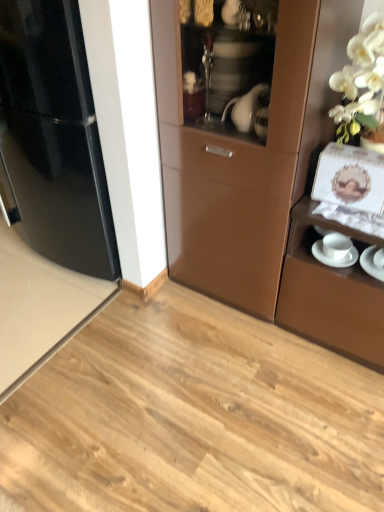
Question: Does white glossy saucer at lower right, marked as the second saucer in a left-to-right arrangement, appear on the left side of glossy black refrigerator at left?

Choices:
 (A) yes
 (B) no

Answer: (B)

Question: From a real-world perspective, is white glossy saucer at lower right, the first saucer in the right-to-left sequence, on glossy black refrigerator at left?

Choices:
 (A) no
 (B) yes

Answer: (A)

Question: From the image's perspective, is white glossy saucer at lower right, the first saucer in the right-to-left sequence, located above glossy black refrigerator at left?

Choices:
 (A) yes
 (B) no

Answer: (B)

Question: From the image's perspective, would you say white glossy saucer at lower right, the first saucer in the right-to-left sequence, is shown under glossy black refrigerator at left?

Choices:
 (A) no
 (B) yes

Answer: (B)

Question: Are white glossy saucer at lower right, marked as the second saucer in a left-to-right arrangement, and glossy black refrigerator at left located far from each other?

Choices:
 (A) no
 (B) yes

Answer: (B)

Question: Is glossy black refrigerator at left at the back of white glossy saucer at lower right, marked as the second saucer in a left-to-right arrangement?

Choices:
 (A) no
 (B) yes

Answer: (A)

Question: From a real-world perspective, is glossy black refrigerator at left beneath white glossy saucer at lower right, the first saucer in the right-to-left sequence?

Choices:
 (A) no
 (B) yes

Answer: (A)

Question: Can you confirm if glossy black refrigerator at left is positioned to the right of white glossy saucer at lower right, the first saucer in the right-to-left sequence?

Choices:
 (A) yes
 (B) no

Answer: (B)

Question: Can you confirm if glossy black refrigerator at left is shorter than white glossy saucer at lower right, the first saucer in the right-to-left sequence?

Choices:
 (A) no
 (B) yes

Answer: (A)

Question: Is glossy black refrigerator at left positioned beyond the bounds of white glossy saucer at lower right, the first saucer in the right-to-left sequence?

Choices:
 (A) no
 (B) yes

Answer: (B)

Question: Is glossy black refrigerator at left oriented away from white glossy saucer at lower right, the first saucer in the right-to-left sequence?

Choices:
 (A) no
 (B) yes

Answer: (A)

Question: Would you say glossy black refrigerator at left is a long distance from white glossy saucer at lower right, the first saucer in the right-to-left sequence?

Choices:
 (A) no
 (B) yes

Answer: (B)

Question: From the image's perspective, is white glossy saucer at right, which ranks as the 1th saucer in left-to-right order, located beneath glossy black refrigerator at left?

Choices:
 (A) yes
 (B) no

Answer: (A)